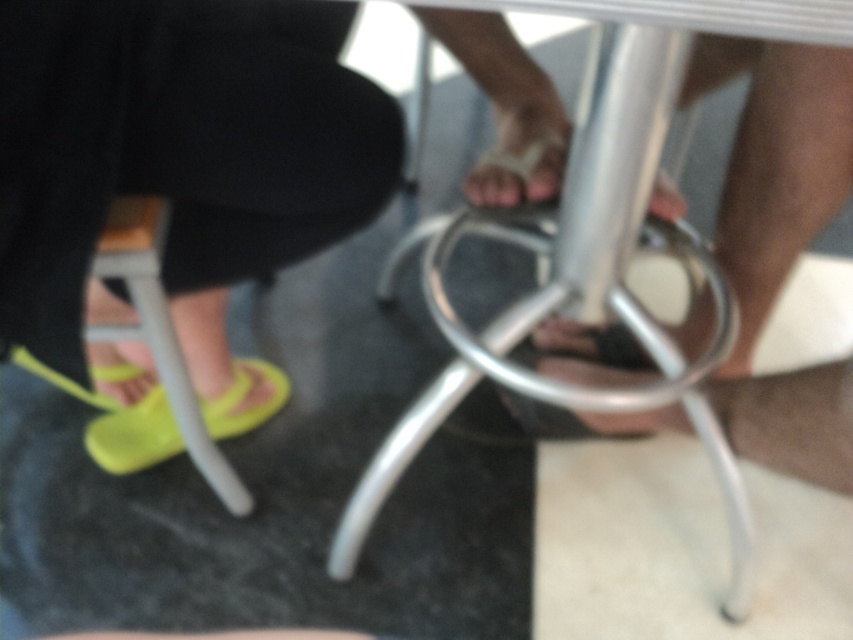
Question: Can you confirm if wooden seat at lower left is thinner than yellow rubber sandal at lower left?

Choices:
 (A) no
 (B) yes

Answer: (B)

Question: Which point appears farthest from the camera in this image?

Choices:
 (A) (102, 426)
 (B) (149, 211)

Answer: (A)

Question: Is wooden seat at lower left to the left of yellow rubber sandal at lower left from the viewer's perspective?

Choices:
 (A) yes
 (B) no

Answer: (B)

Question: Does wooden seat at lower left appear on the left side of yellow rubber sandal at lower left?

Choices:
 (A) yes
 (B) no

Answer: (B)